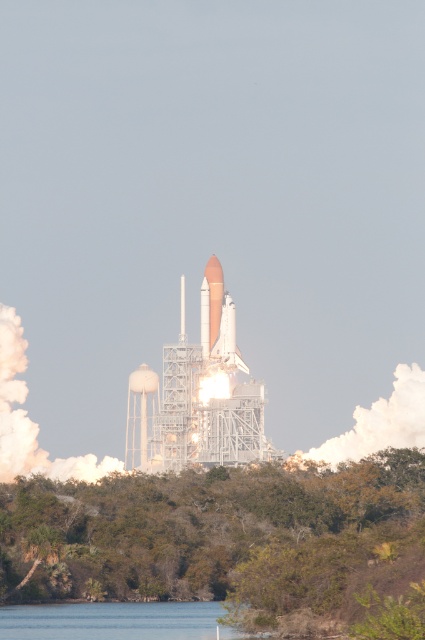
Question: Can you confirm if clear water at lower center is positioned below white glossy shuttle at center?

Choices:
 (A) yes
 (B) no

Answer: (A)

Question: Among these points, which one is nearest to the camera?

Choices:
 (A) (209, 304)
 (B) (214, 355)

Answer: (B)

Question: Which point is farther to the camera?

Choices:
 (A) (107, 630)
 (B) (209, 328)

Answer: (B)

Question: Is white glossy shuttle at center positioned in front of matte white shuttle at center?

Choices:
 (A) yes
 (B) no

Answer: (A)

Question: Is white glossy shuttle at center in front of matte white shuttle at center?

Choices:
 (A) yes
 (B) no

Answer: (A)

Question: Considering the real-world distances, which object is farthest from the white glossy shuttle at center?

Choices:
 (A) matte white shuttle at center
 (B) clear water at lower center

Answer: (B)